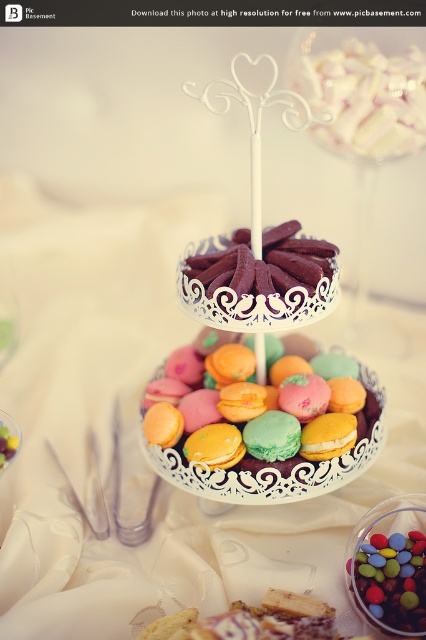
Based on the photo, is pastel macarons at center closer to the viewer compared to multicolored coated chocolate at center?

No, pastel macarons at center is behind multicolored coated chocolate at center.

Between pastel macarons at center and multicolored coated chocolate at center, which one is positioned lower?

multicolored coated chocolate at center is below.

Is point (261, 403) less distant than point (397, 602)?

No, (261, 403) is behind (397, 602).

What are the coordinates of `pastel macarons at center` in the screenshot? It's located at (256, 410).

Does white satin tablecloth at center come behind pastel macarons at center?

No, it is not.

At what (x,y) coordinates should I click in order to perform the action: click on white satin tablecloth at center. Please return your answer as a coordinate pair (x, y). Looking at the image, I should click on (109, 432).

Where is `white satin tablecloth at center`? The width and height of the screenshot is (426, 640). white satin tablecloth at center is located at coordinates (109, 432).

Which of these two, white satin tablecloth at center or multicolored coated chocolate at center, stands shorter?

multicolored coated chocolate at center

Consider the image. Is white satin tablecloth at center smaller than multicolored coated chocolate at center?

Actually, white satin tablecloth at center might be larger than multicolored coated chocolate at center.

Describe the element at coordinates (109, 432) in the screenshot. I see `white satin tablecloth at center` at that location.

At what (x,y) coordinates should I click in order to perform the action: click on white satin tablecloth at center. Please return your answer as a coordinate pair (x, y). The width and height of the screenshot is (426, 640). Looking at the image, I should click on (109, 432).